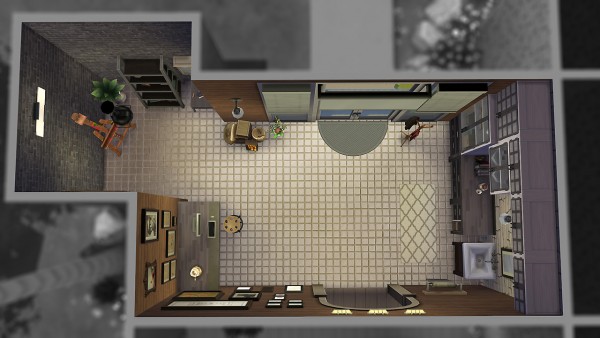
Image resolution: width=600 pixels, height=338 pixels. Find the location of `wall`. wall is located at coordinates (503, 136).